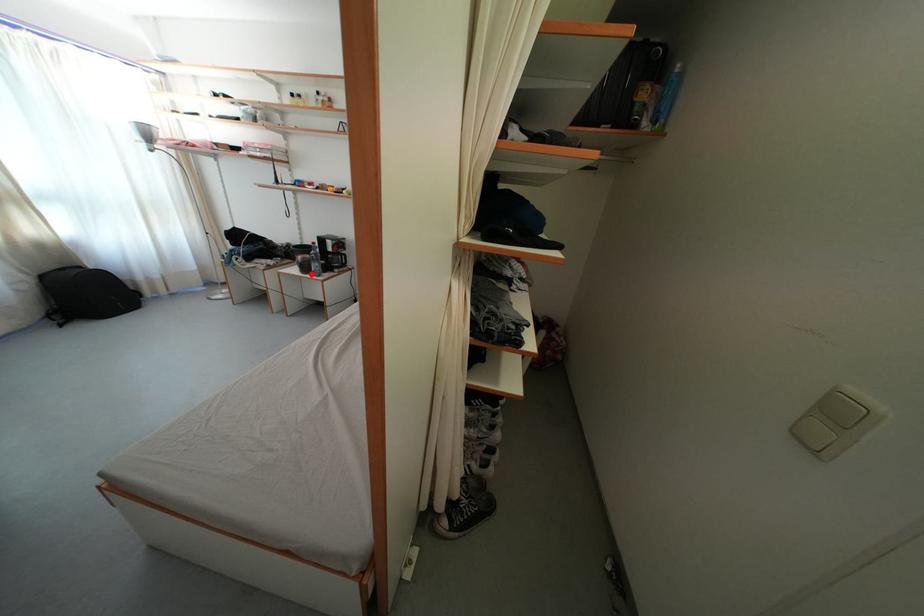
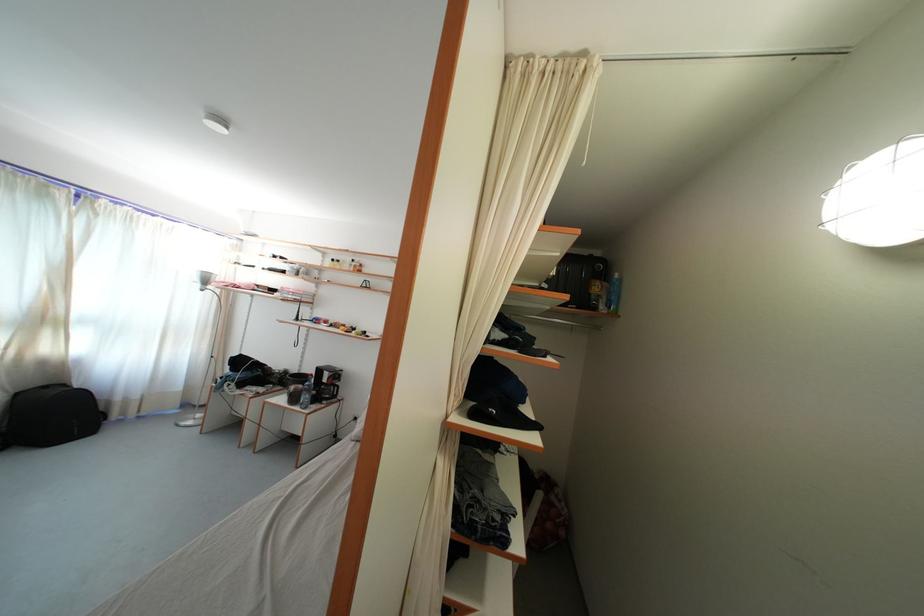
Question: A red point is marked in image1. In image2, is the corresponding 3D point closer to the camera or farther? Reply with the corresponding letter.

Choices:
 (A) The corresponding 3D point is closer.
 (B) The corresponding 3D point is farther.

Answer: (B)